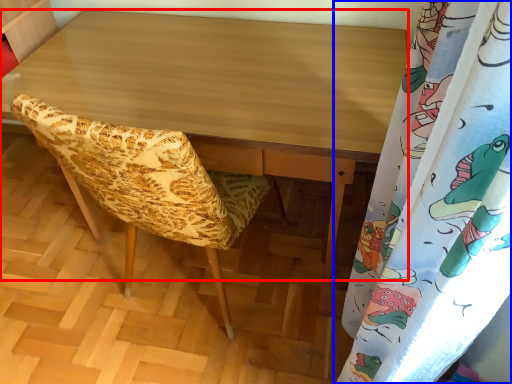
Question: Which object is closer to the camera taking this photo, desk (highlighted by a red box) or curtain (highlighted by a blue box)?

Choices:
 (A) desk
 (B) curtain

Answer: (B)